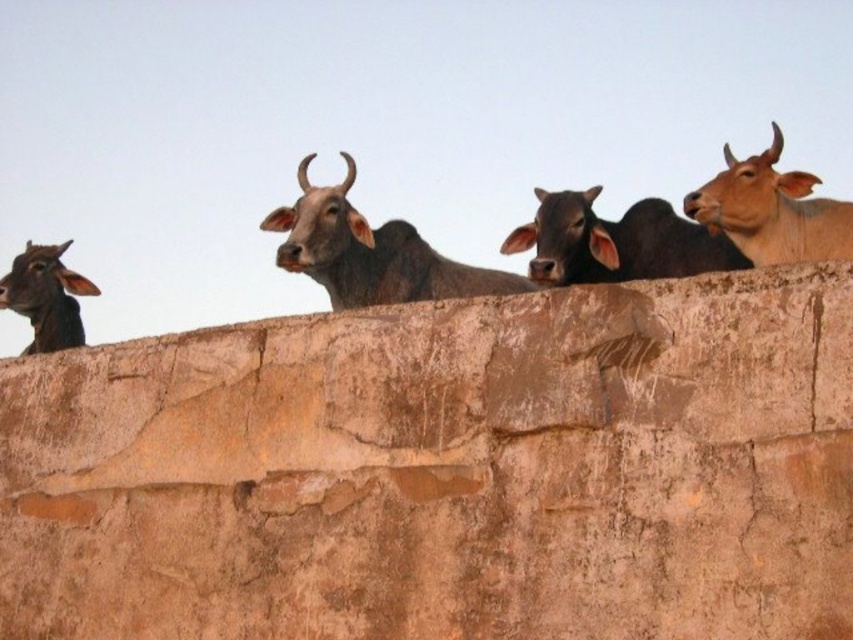
Question: Is light brown smooth cow at upper right above shiny black bull at left?

Choices:
 (A) yes
 (B) no

Answer: (A)

Question: Which object is closer to the camera taking this photo?

Choices:
 (A) light brown smooth cow at upper right
 (B) brown matte cow at center

Answer: (A)

Question: Among these points, which one is nearest to the camera?

Choices:
 (A) (351, 205)
 (B) (848, 548)
 (C) (746, 243)

Answer: (B)

Question: Is shiny brown bull at center positioned behind brown matte cow at center?

Choices:
 (A) no
 (B) yes

Answer: (B)

Question: Is shiny brown bull at center wider than brown matte cow at center?

Choices:
 (A) yes
 (B) no

Answer: (A)

Question: Among these points, which one is farthest from the camera?

Choices:
 (A) (352, 180)
 (B) (627, 220)

Answer: (A)